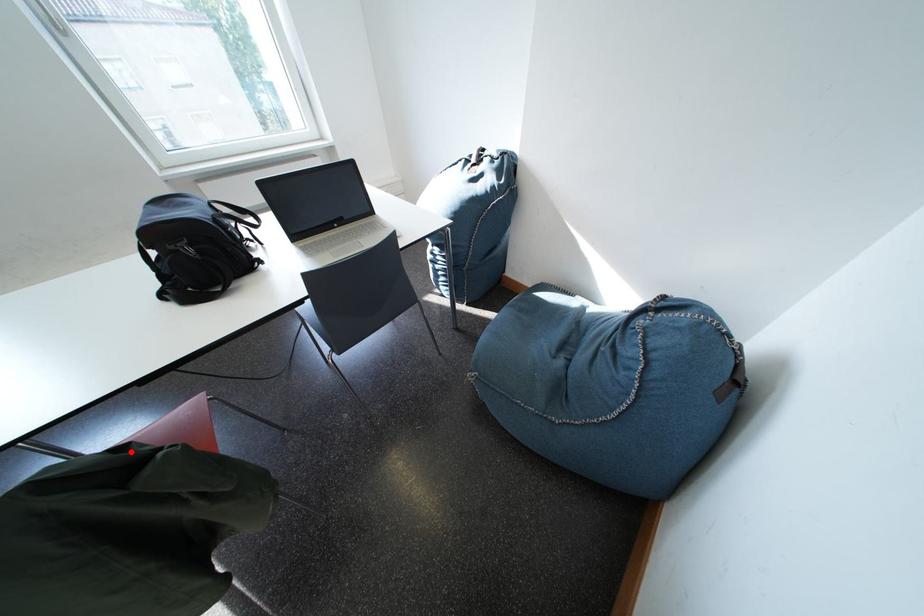
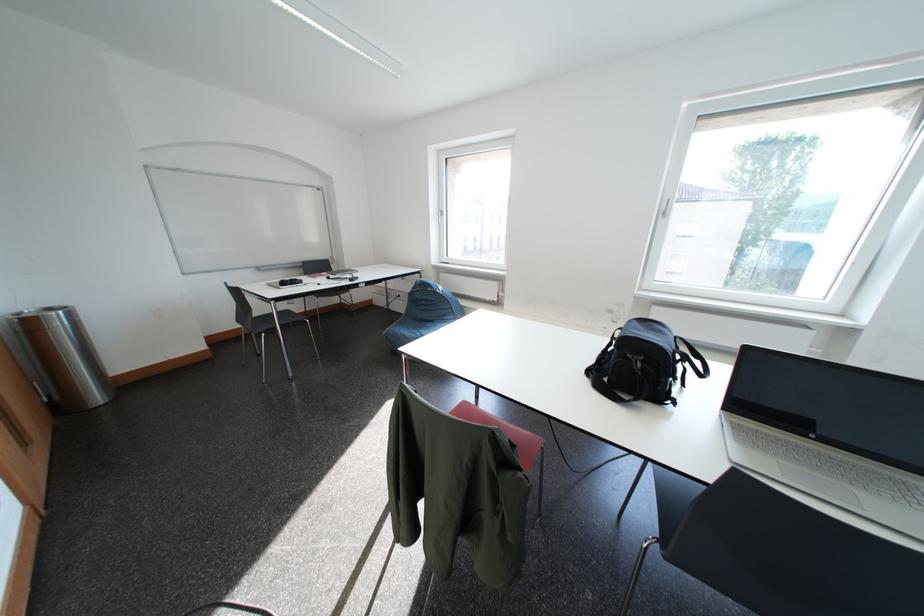
Question: I am providing you with two images of the same scene from different viewpoints. Image1 has a red point marked. In image2, the corresponding 3D location appears at what relative position? Reply with the corresponding letter.

Choices:
 (A) Closer
 (B) Farther

Answer: (A)